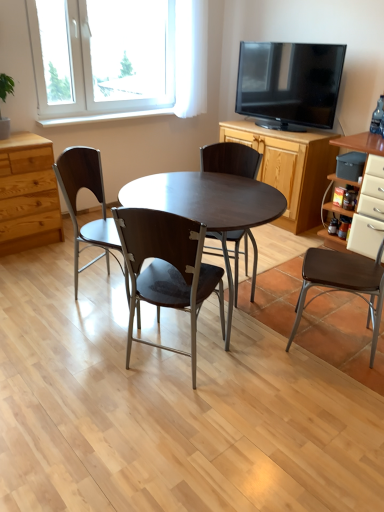
The width and height of the screenshot is (384, 512). I want to click on vacant space in front of matte dark wood table at center, so click(x=203, y=422).